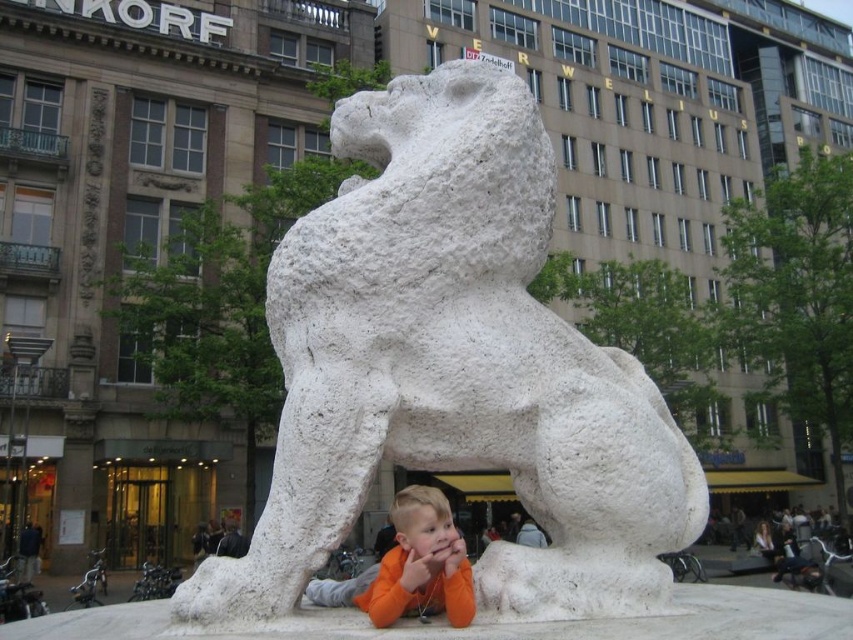
You are a photographer standing 10 feet away from the white stone lion at center. You want to take a photo of the orange cotton shirt at lower center without including the lion in the frame. Is it possible? Please explain.

The white stone lion at center is 9.04 feet away from the orange cotton shirt at lower center. Since you are standing 10 feet away from the lion, you are approximately 19.04 feet away from the orange cotton shirt at lower center. To exclude the lion from the frame, you need to ensure the shirt is not in the same line of sight as the lion. However, without knowing the camera angle or lens type, it is impossible to determine if the lion will be in the frame. Adjust your position or use a wide angle lens to re

You are a photographer trying to capture the white stone lion at center and the orange cotton shirt at lower center in a single shot. Which object should you focus on first if you want to ensure both are in focus?

The white stone lion at center is above the orange cotton shirt at lower center, so focusing on the lion first will help ensure both are in focus as the shirt is closer to the camera.

You are standing 30 feet away from the camera. Can you see the white stone lion at center clearly?

The white stone lion at center is 29.80 feet away from the camera, so yes, you can see it clearly since you are only 0.2 feet farther than the lion from the camera.